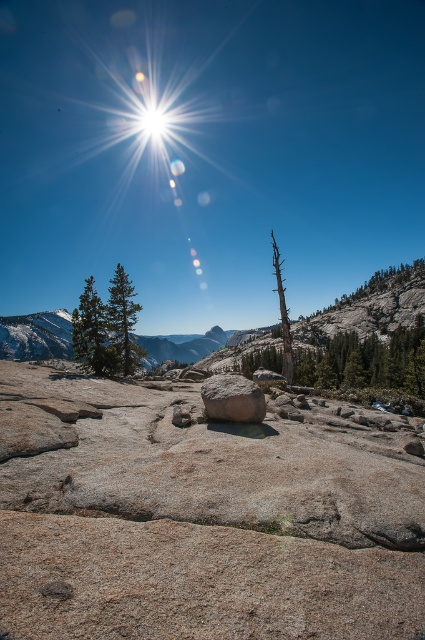
You are a hiker trying to determine which object is wider between the smooth gray tree at center and the dead wood at center. Based on the scene, which one is wider?

The smooth gray tree at center is wider than the dead wood at center according to the description.

You are a photographer planning to capture a landscape shot of the gray granite boulder at center and the dead wood at center. Since the sun is near the top left corner, which object might cast a longer shadow towards the right side of the image?

The gray granite boulder at center is to the left of the dead wood at center. Since the sun is in the top left, the gray granite boulder at center, being closer to the light source, will cast a shorter shadow. Conversely, the dead wood at center, positioned further from the sun, will cast a longer shadow extending towards the right side of the image.

You are a hiker who wants to take a photo of the smooth gray tree at center and the dead wood at center. Which object should you focus on first if you want to capture both in the same frame without moving the camera?

The smooth gray tree at center is larger in size than dead wood at center, so you should focus on the smooth gray tree at center first to ensure it fills the frame appropriately before adjusting for the smaller dead wood at center.